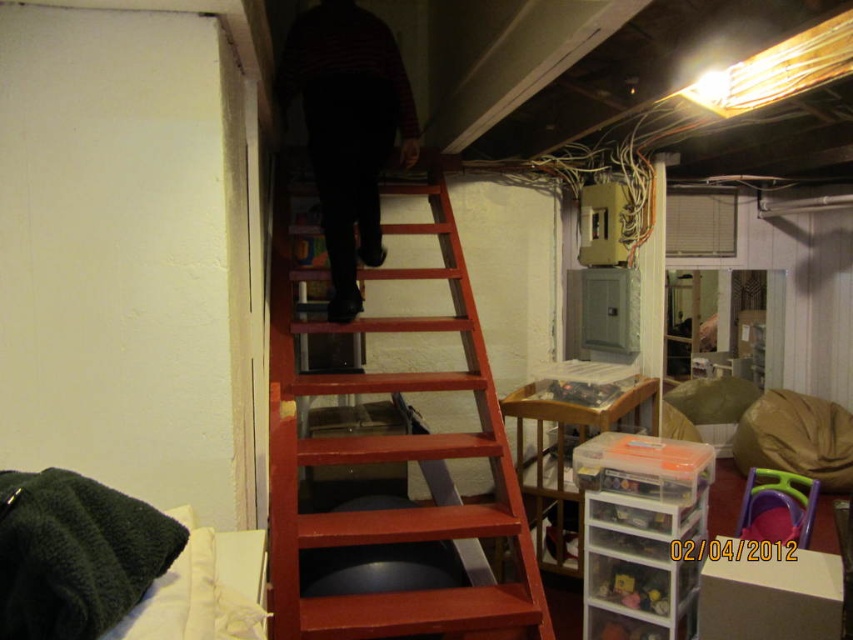
Which is in front, point (352, 372) or point (355, 24)?

Point (355, 24) is in front.

The image size is (853, 640). I want to click on wooden ladder at center, so click(392, 456).